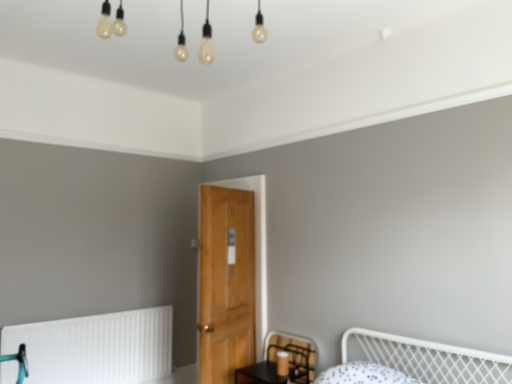
Question: Would you say black mesh swivel chair at lower center is to the left or to the right of white matte radiator at lower left in the picture?

Choices:
 (A) left
 (B) right

Answer: (B)

Question: Is point (283, 347) closer or farther from the camera than point (142, 357)?

Choices:
 (A) closer
 (B) farther

Answer: (A)

Question: Estimate the real-world distances between objects in this image. Which object is farther from the white matte radiator at lower left?

Choices:
 (A) black mesh swivel chair at lower center
 (B) wooden door at center

Answer: (B)

Question: Which object is positioned farthest from the black mesh swivel chair at lower center?

Choices:
 (A) wooden door at center
 (B) white matte radiator at lower left

Answer: (B)